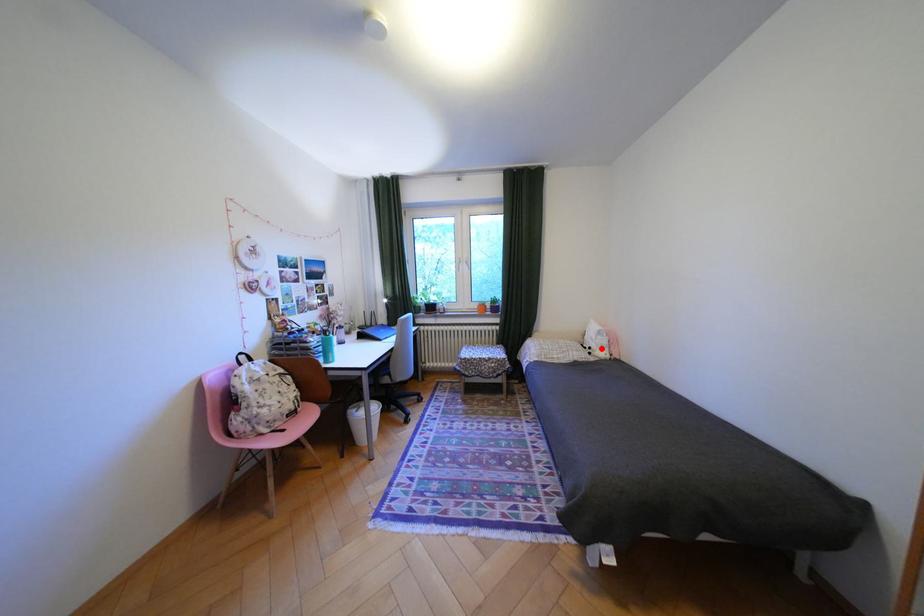
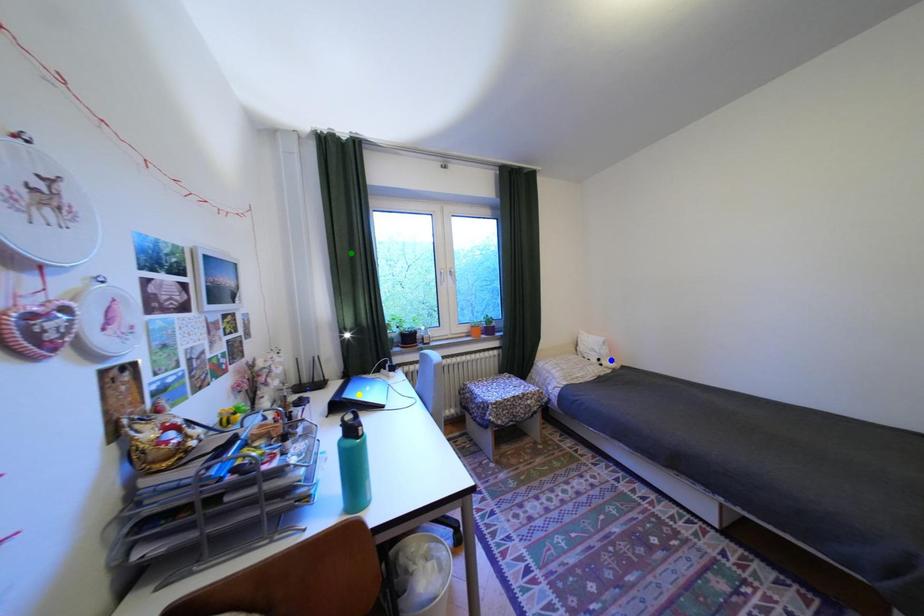
Question: I am providing you with two images of the same scene from different viewpoints. A red point is marked on the first image. You are given multiple points on the second image. Which spot in image 2 lines up with the point in image 1?

Choices:
 (A) green point
 (B) blue point
 (C) yellow point

Answer: (B)